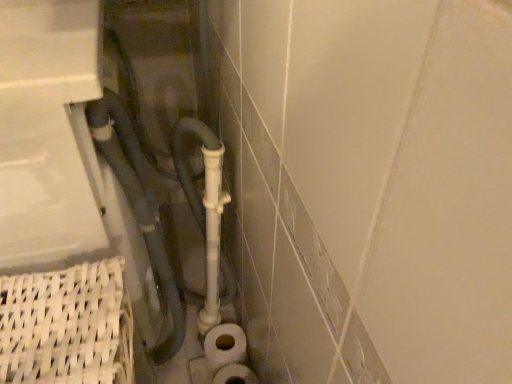
Question: From the image's perspective, relative to white matte toilet paper at lower center, is matte gray pipe at center above or below?

Choices:
 (A) below
 (B) above

Answer: (B)

Question: Is point coord(144,170) closer or farther from the camera than point coord(248,375)?

Choices:
 (A) farther
 (B) closer

Answer: (B)

Question: Considering the positions of matte gray pipe at center and white matte toilet paper at lower center in the image, is matte gray pipe at center taller or shorter than white matte toilet paper at lower center?

Choices:
 (A) short
 (B) tall

Answer: (B)

Question: Considering the positions of white matte toilet paper at lower center and matte gray pipe at center in the image, is white matte toilet paper at lower center wider or thinner than matte gray pipe at center?

Choices:
 (A) thin
 (B) wide

Answer: (A)

Question: Considering the positions of white matte toilet paper at lower center and matte gray pipe at center in the image, is white matte toilet paper at lower center taller or shorter than matte gray pipe at center?

Choices:
 (A) short
 (B) tall

Answer: (A)

Question: From a real-world perspective, is white matte toilet paper at lower center positioned above or below matte gray pipe at center?

Choices:
 (A) above
 (B) below

Answer: (B)

Question: Is white matte toilet paper at lower center to the left or to the right of matte gray pipe at center in the image?

Choices:
 (A) right
 (B) left

Answer: (A)